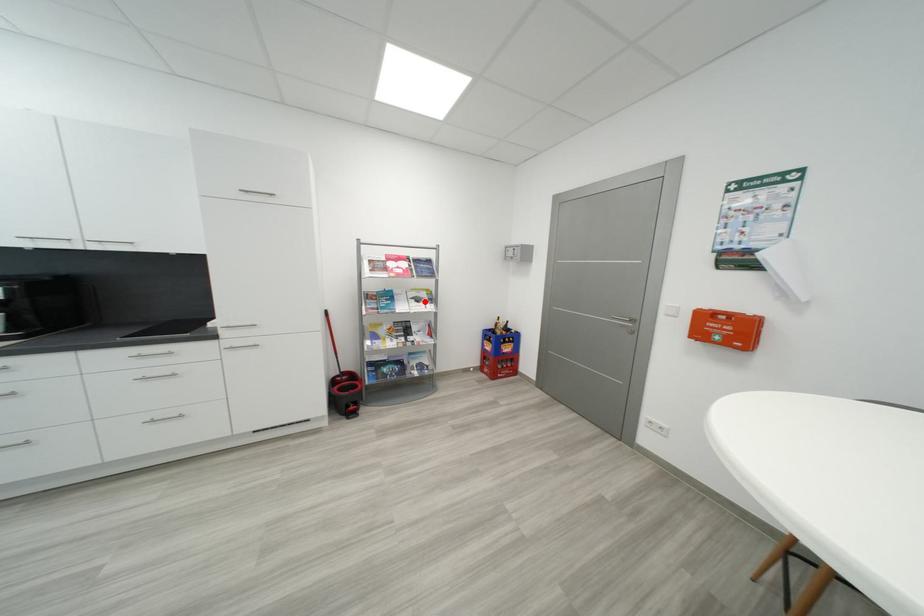
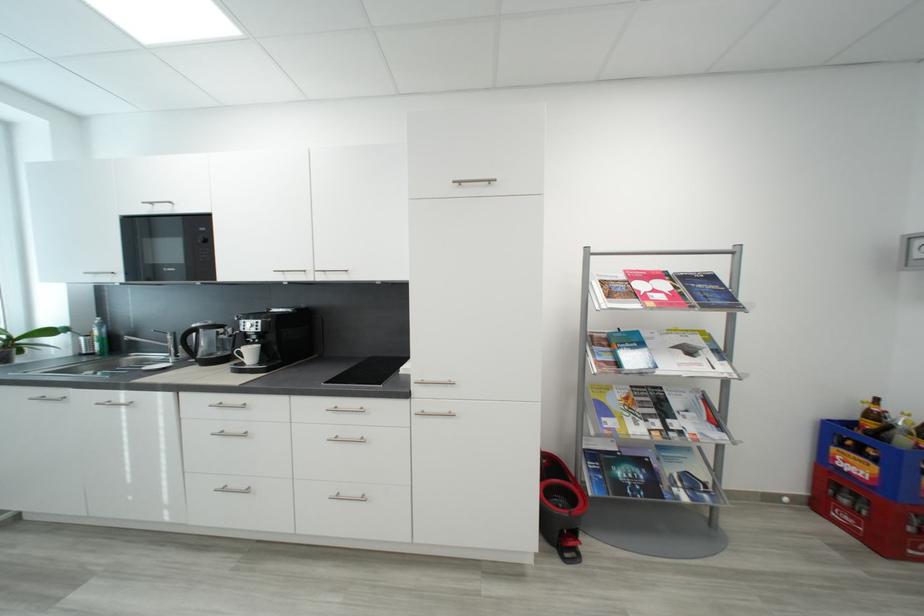
The point at the highlighted location is marked in the first image. Where is the corresponding point in the second image?

(697, 353)